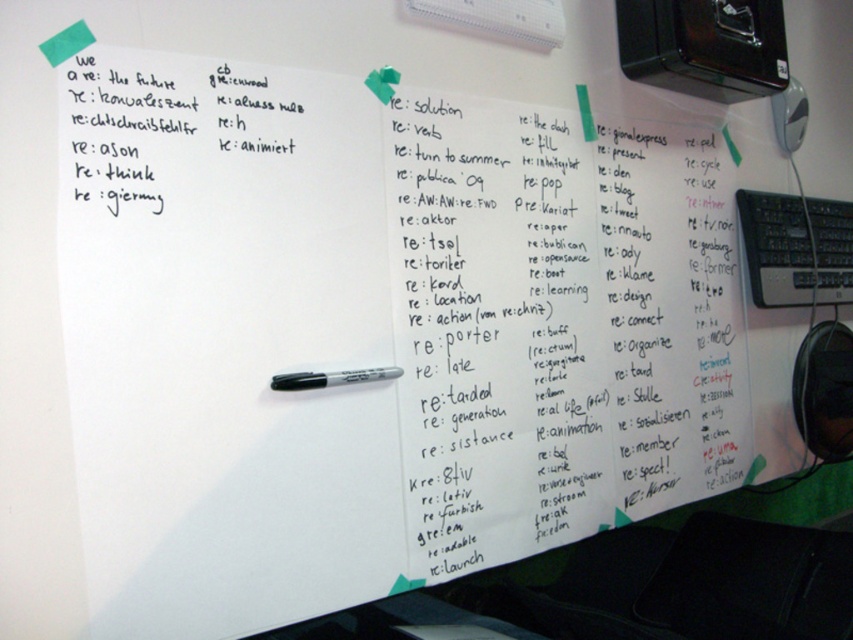
You are a student who needs to reach the black plastic keyboard at right from where you are standing in front of the whiteboard. Can you do it without moving your feet?

The distance between you and the black plastic keyboard at right is 1.37 meters. Since the average person can reach about 0.9 meters without moving their feet, you might not be able to reach it comfortably.

You are a student trying to take a photo of the whiteboard. You notice the black plastic keyboard at right and the green matte sticky note at upper left. Which object is blocking your view of the other?

The green matte sticky note at upper left is behind the black plastic keyboard at right, so the black plastic keyboard at right is blocking the view of the green matte sticky note at upper left.

You need to write a note on the whiteboard but you are 1.8 meters tall. Can you comfortably reach the black marker pen at center and the green matte sticky note at upper left without standing on something?

The black marker pen at center is shorter than the green matte sticky note at upper left, so you can comfortably reach the black marker pen at center but may have difficulty reaching the green matte sticky note at upper left without standing on something.